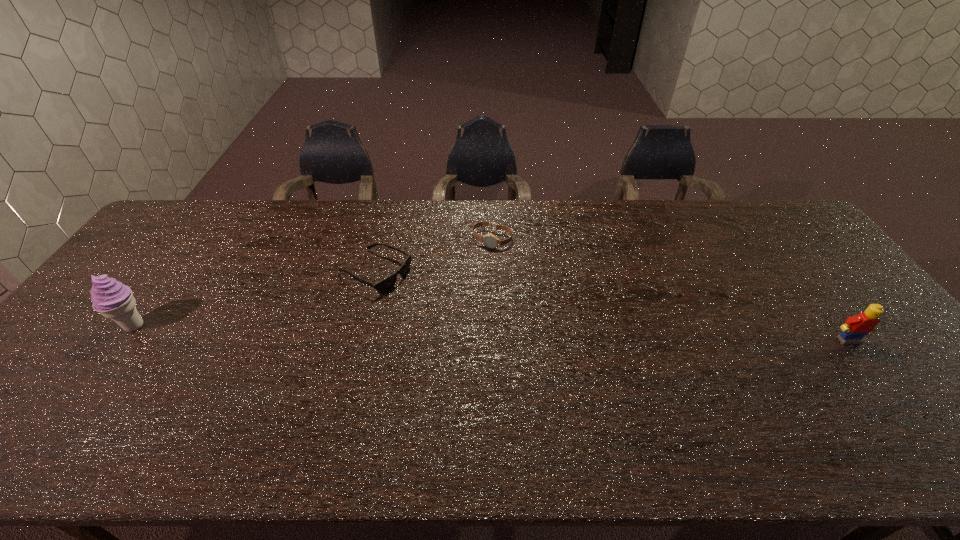
This screenshot has height=540, width=960. Identify the location of vacant space situated 0.180m on the face of the watch. (465, 287).

This screenshot has height=540, width=960. What are the coordinates of `free region located 0.060m on the front-facing side of the sunglasses` in the screenshot? It's located at (420, 294).

Image resolution: width=960 pixels, height=540 pixels. I want to click on free spot located 0.050m on the front-facing side of the sunglasses, so click(417, 292).

Where is `vacant space located on the front-facing side of the sunglasses`? The image size is (960, 540). vacant space located on the front-facing side of the sunglasses is located at coordinates 439,303.

You are a GUI agent. You are given a task and a screenshot of the screen. Output one action in this format:
    pyautogui.click(x=<x>, y=<y>)
    Task: Click on the object present at the far edge
    
    Given the screenshot: What is the action you would take?
    pyautogui.click(x=489, y=240)

The height and width of the screenshot is (540, 960). Find the location of `object present at the left edge`. object present at the left edge is located at coordinates (114, 300).

Find the location of a particular element. Image resolution: width=960 pixels, height=540 pixels. object situated at the right edge is located at coordinates (855, 328).

In the image, there is a desktop. Where is `vacant space at the far edge`? The width and height of the screenshot is (960, 540). vacant space at the far edge is located at coordinates (400, 234).

I want to click on free space at the near edge, so click(x=195, y=397).

In the image, there is a desktop. Find the location of `free space at the right edge`. free space at the right edge is located at coordinates (800, 259).